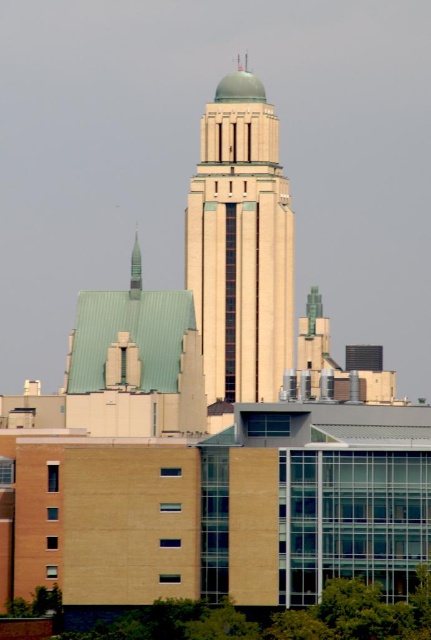
Between beige concrete tower at center and green matte spire at upper center, which one appears on the right side from the viewer's perspective?

beige concrete tower at center is more to the right.

Does point (253, 182) come behind point (133, 291)?

Yes, it is behind point (133, 291).

The image size is (431, 640). Identify the location of beige concrete tower at center. (240, 244).